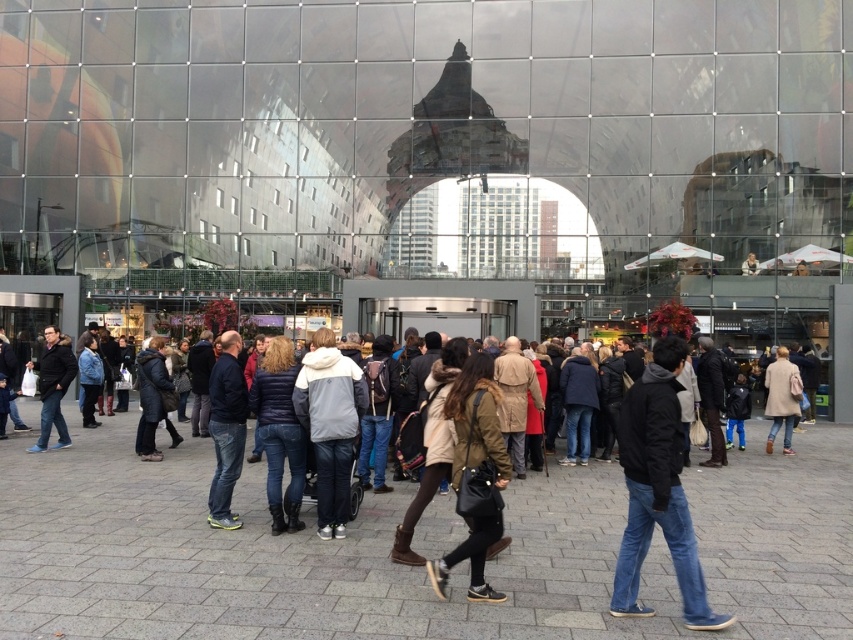
Question: Estimate the real-world distances between objects in this image. Which object is closer to the dark blue jacket at center?

Choices:
 (A) denim jacket at center
 (B) dark blue jacket at left

Answer: (A)

Question: Is dark blue quilted jacket at center wider than beige wool coat at center?

Choices:
 (A) no
 (B) yes

Answer: (B)

Question: Does dark blue jacket at left have a greater width compared to beige wool coat at center?

Choices:
 (A) no
 (B) yes

Answer: (A)

Question: Does dark blue jacket at center have a lesser width compared to beige wool coat at center?

Choices:
 (A) no
 (B) yes

Answer: (B)

Question: Which point is farther to the camera?

Choices:
 (A) dark blue quilted jacket at center
 (B) brown leather jacket at center
 (C) dark blue jeans at center

Answer: (A)

Question: Which of the following is the farthest from the observer?

Choices:
 (A) gray fleece jacket at center
 (B) dark blue jacket at left

Answer: (B)